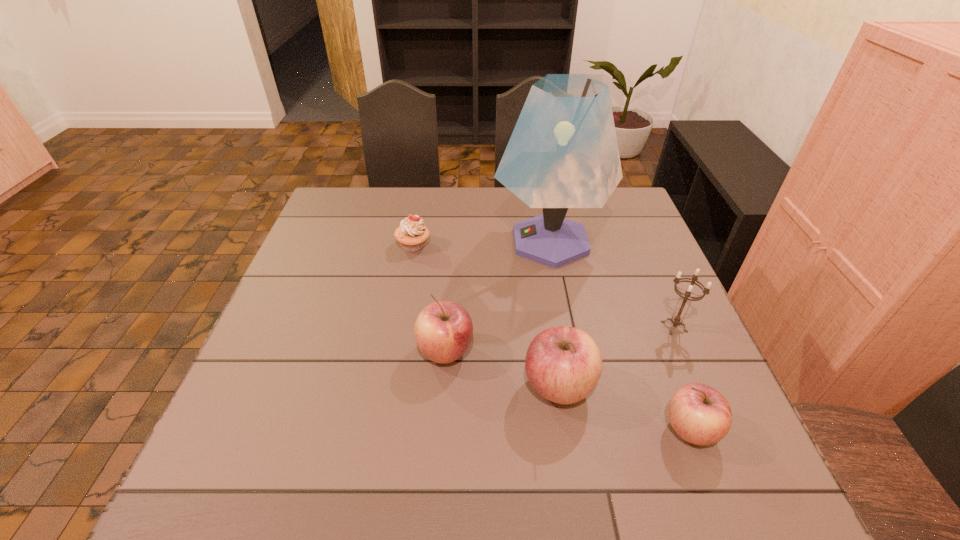
The image size is (960, 540). Identify the location of vacant space situated 0.350m on the base of the tallest object. (372, 241).

The width and height of the screenshot is (960, 540). In order to click on vacant space located on the base of the tallest object in this screenshot , I will do `click(462, 241)`.

Where is `vacant space located on the base of the tallest object`? vacant space located on the base of the tallest object is located at coordinates (356, 241).

Find the location of a particular element. vacant area situated on the left of the candle holder is located at coordinates pyautogui.click(x=601, y=327).

Where is `blank space located on the right of the leftmost object`? The height and width of the screenshot is (540, 960). blank space located on the right of the leftmost object is located at coordinates (538, 245).

Where is `object positioned at the far edge`? The image size is (960, 540). object positioned at the far edge is located at coordinates (563, 153).

Locate an element on the screen. The width and height of the screenshot is (960, 540). apple that is at the right edge is located at coordinates pyautogui.click(x=699, y=414).

I want to click on lampshade that is at the right edge, so click(x=563, y=153).

At what (x,y) coordinates should I click in order to perform the action: click on candle holder present at the right edge. Please return your answer as a coordinate pair (x, y). This screenshot has width=960, height=540. Looking at the image, I should click on (676, 320).

Locate an element on the screen. The width and height of the screenshot is (960, 540). object at the far right corner is located at coordinates (563, 153).